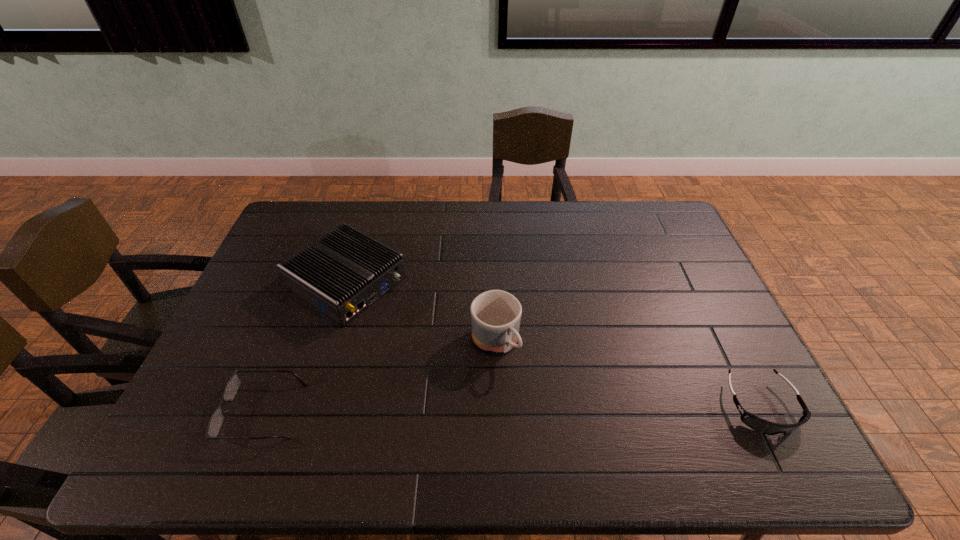
At what (x,y) coordinates should I click in order to perform the action: click on the shortest object. Please return your answer as a coordinate pair (x, y). Image resolution: width=960 pixels, height=540 pixels. Looking at the image, I should click on (232, 386).

Locate an element on the screen. Image resolution: width=960 pixels, height=540 pixels. the third tallest object is located at coordinates (758, 424).

Locate an element on the screen. Image resolution: width=960 pixels, height=540 pixels. the rightmost object is located at coordinates (758, 424).

You are a GUI agent. You are given a task and a screenshot of the screen. Output one action in this format:
    pyautogui.click(x=<x>, y=<y>)
    Task: Click on the router
    Image resolution: width=960 pixels, height=540 pixels.
    Given the screenshot: What is the action you would take?
    coord(341,274)

This screenshot has width=960, height=540. I want to click on the third object from left to right, so click(495, 314).

Image resolution: width=960 pixels, height=540 pixels. I want to click on the tallest object, so click(495, 314).

Identify the location of free space located 0.060m on the front-facing side of the shortest object. The image size is (960, 540). (201, 411).

The width and height of the screenshot is (960, 540). In order to click on vacant position located on the front-facing side of the shortest object in this screenshot , I will do `click(188, 411)`.

The image size is (960, 540). Find the location of `vacant area located on the back panel of the router`. vacant area located on the back panel of the router is located at coordinates (491, 372).

Image resolution: width=960 pixels, height=540 pixels. In order to click on free location located 0.120m on the back panel of the router in this screenshot , I will do `click(420, 327)`.